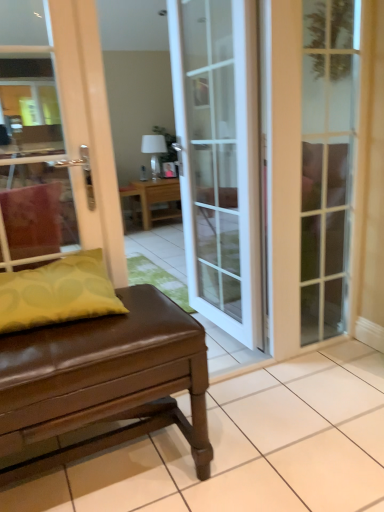
Question: Is wooden table at center, the second table when ordered from front to back, bigger or smaller than white glass door at center, marked as the first door in a left-to-right arrangement?

Choices:
 (A) small
 (B) big

Answer: (B)

Question: Considering the positions of wooden table at center, the second table when ordered from front to back, and white glass door at center, the second door in the right-to-left sequence, in the image, is wooden table at center, the second table when ordered from front to back, taller or shorter than white glass door at center, the second door in the right-to-left sequence,?

Choices:
 (A) tall
 (B) short

Answer: (B)

Question: Considering the real-world distances, which object is farthest from the yellow fabric pillow at left?

Choices:
 (A) brown leather bench at lower left, which is the first table from front to back
 (B) white glass door at center, marked as the first door in a left-to-right arrangement
 (C) clear glass door at right, arranged as the second door when viewed from the left
 (D) wooden table at center, which is the second table from bottom to top
 (E) white glossy lampshade at center

Answer: (E)

Question: Considering the real-world distances, which object is farthest from the yellow fabric pillow at left?

Choices:
 (A) white glass door at center, the second door in the right-to-left sequence
 (B) clear glass door at right, the first door positioned from the right
 (C) brown leather bench at lower left, the 2th table when ordered from top to bottom
 (D) wooden table at center, positioned as the 1th table in top-to-bottom order
 (E) white glossy lampshade at center

Answer: (E)